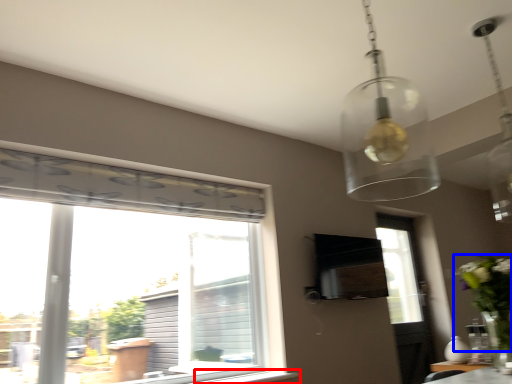
Question: Among these objects, which one is farthest to the camera, window sill (highlighted by a red box) or floral arrangement (highlighted by a blue box)?

Choices:
 (A) window sill
 (B) floral arrangement

Answer: (A)